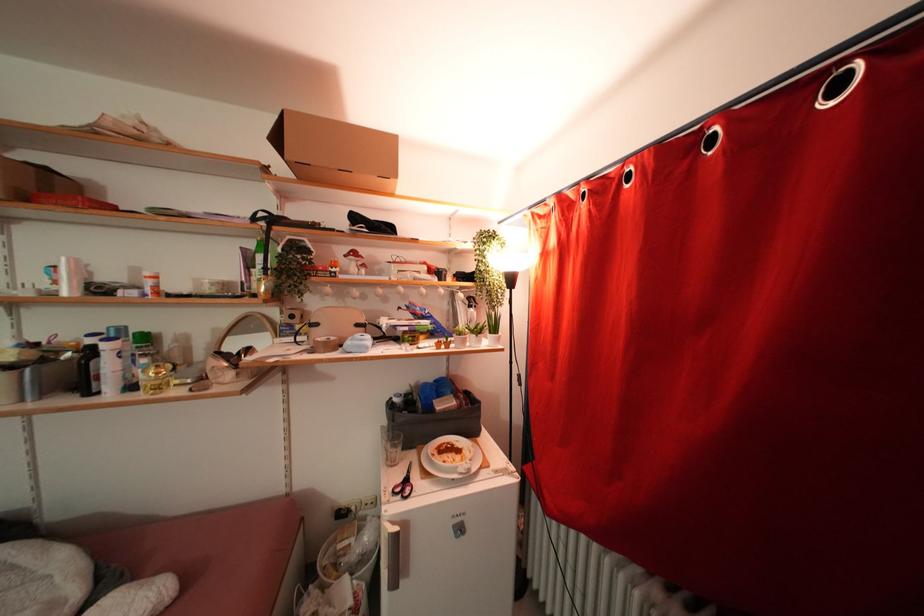
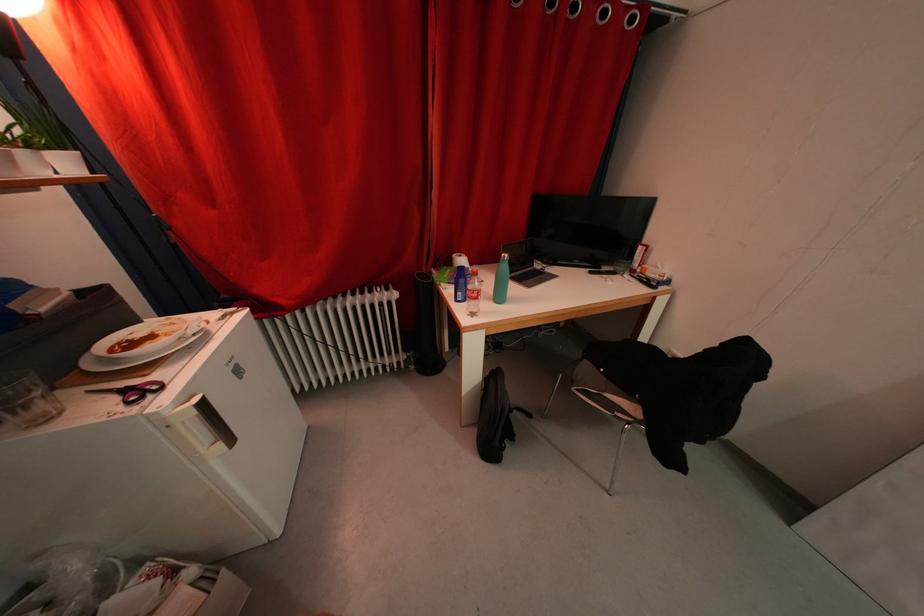
Locate, in the second image, the point that corresponds to the point at 465,455 in the first image.

(157, 341)